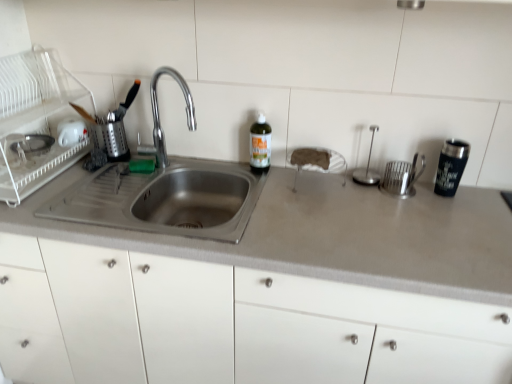
The image size is (512, 384). Find the location of `free point to the left of silver metallic utensil holder at right, which is the 5th appliance from left to right`. free point to the left of silver metallic utensil holder at right, which is the 5th appliance from left to right is located at coordinates (357, 198).